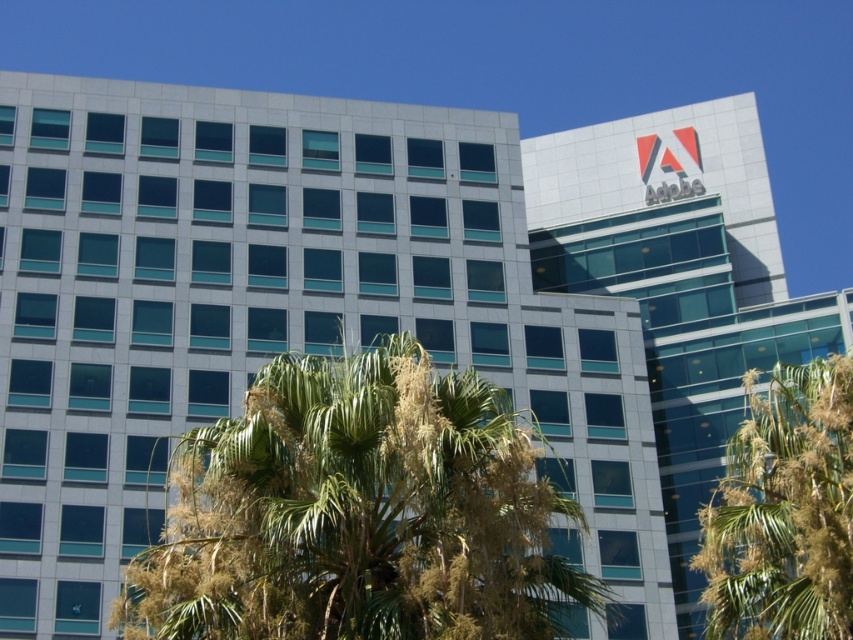
You are standing in front of the modern office building and want to take a photo of the green leafy palm tree at center. If your camera has a maximum focus range of 20 meters, will you be able to capture the palm tree clearly?

The distance between you and the green leafy palm tree at center is 18.25 meters, which is within the camera maximum focus range of 20 meters. So yes, you can capture the palm tree clearly.

You are standing at the entrance of the modern office building and see the point marked at coordinates (358, 513). What object is located at that point?

The point at coordinates (358, 513) corresponds to the green leafy palm tree at center.

You are standing in front of the modern office building and want to take a photo of the Adobe logo. There are two green leafy trees in the scene. Which tree, the green leafy palm tree at center or the green leafy tree at lower right, is closer to the building?

The green leafy tree at lower right is closer to the building because it is positioned below the green leafy palm tree at center, which is higher up in the image.